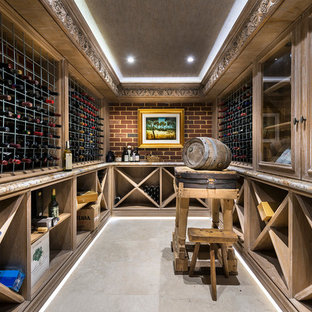
Identify the location of white picture matting. (143, 127).